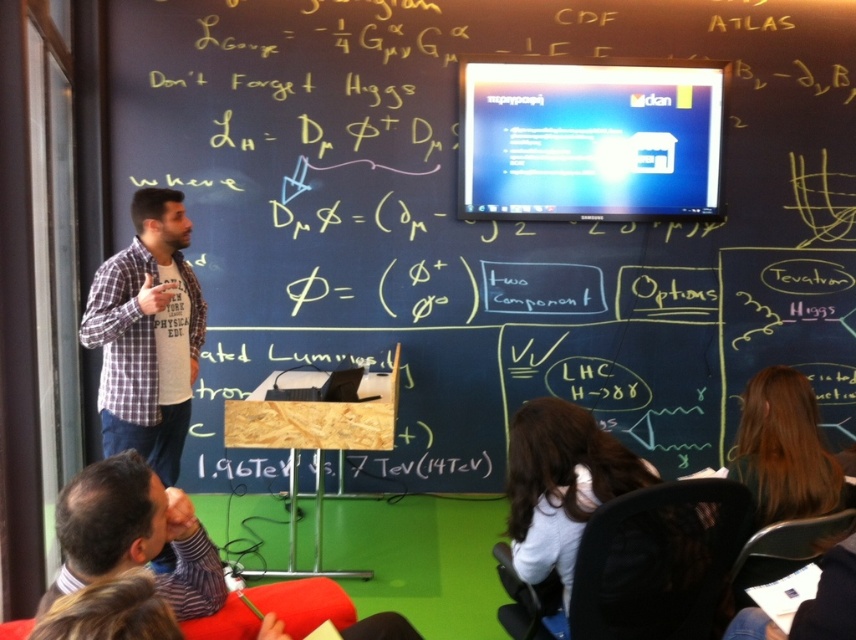
Question: Considering the relative positions of plaid shirt at left and dark brown leather jacket at lower left in the image provided, where is plaid shirt at left located with respect to dark brown leather jacket at lower left?

Choices:
 (A) left
 (B) right

Answer: (A)

Question: Can you confirm if plaid shirt at left is positioned above white fabric shirt at lower right?

Choices:
 (A) yes
 (B) no

Answer: (A)

Question: Among these objects, which one is farthest from the camera?

Choices:
 (A) white fabric shirt at lower right
 (B) plaid shirt at left

Answer: (B)

Question: Among these points, which one is farthest from the camera?

Choices:
 (A) (599, 432)
 (B) (140, 548)
 (C) (167, 432)
 (D) (733, 76)

Answer: (D)

Question: Which point is closer to the camera taking this photo?

Choices:
 (A) (183, 556)
 (B) (514, 499)
 (C) (661, 397)

Answer: (A)

Question: Is plaid shirt at left wider than white fabric shirt at lower right?

Choices:
 (A) no
 (B) yes

Answer: (A)